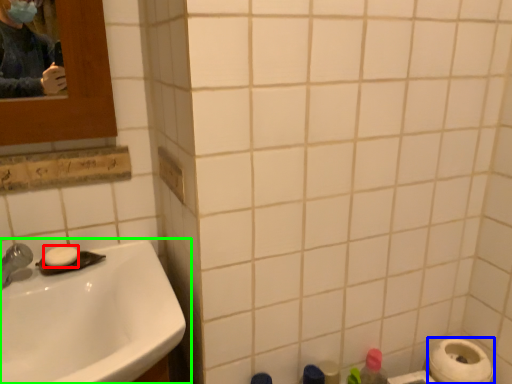
Question: Estimate the real-world distances between objects in this image. Which object is closer to soap (highlighted by a red box), toilet paper (highlighted by a blue box) or sink (highlighted by a green box)?

Choices:
 (A) toilet paper
 (B) sink

Answer: (B)